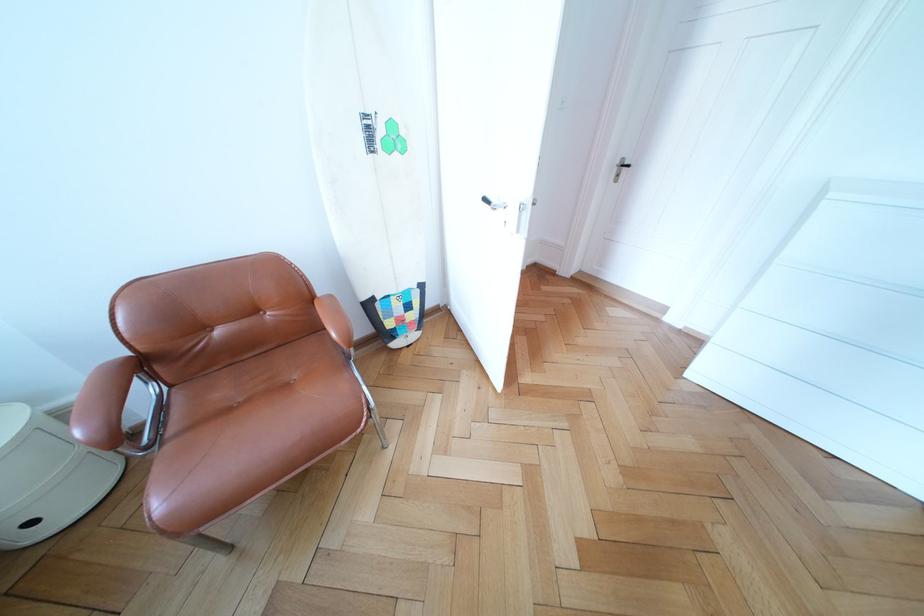
Find where to lift the white surfboard. Please return your answer as a coordinate pair (x, y).

(369, 161)